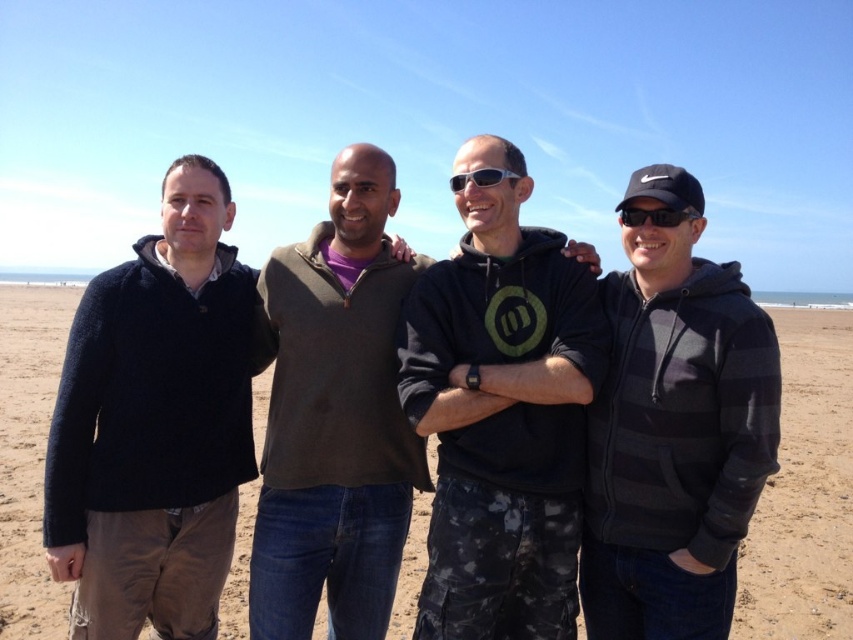
Which is below, sandy beach at lower center or dark gray sweater at center?

dark gray sweater at center is below.

Find the location of `sandy beach at lower center`. sandy beach at lower center is located at coordinates (804, 492).

You are a GUI agent. You are given a task and a screenshot of the screen. Output one action in this format:
    pyautogui.click(x=<x>, y=<y>)
    Task: Click on the sandy beach at lower center
    
    Given the screenshot: What is the action you would take?
    pyautogui.click(x=804, y=492)

Which is more to the left, dark blue sweater at left or striped hoodie at right?

From the viewer's perspective, dark blue sweater at left appears more on the left side.

Is dark blue sweater at left below striped hoodie at right?

Correct, dark blue sweater at left is located below striped hoodie at right.

Describe the element at coordinates (155, 422) in the screenshot. I see `dark blue sweater at left` at that location.

You are a GUI agent. You are given a task and a screenshot of the screen. Output one action in this format:
    pyautogui.click(x=<x>, y=<y>)
    Task: Click on the dark blue sweater at left
    The height and width of the screenshot is (640, 853).
    Given the screenshot: What is the action you would take?
    pyautogui.click(x=155, y=422)

Based on the photo, who is shorter, striped hoodie at right or black plastic sunglasses at right?

With less height is black plastic sunglasses at right.

Between point (648, 392) and point (622, 208), which one is positioned in front?

Point (648, 392) is more forward.

Based on the photo, who is more forward, (666, 296) or (672, 218)?

Point (672, 218)

Find the location of `striped hoodie at right`. striped hoodie at right is located at coordinates (674, 429).